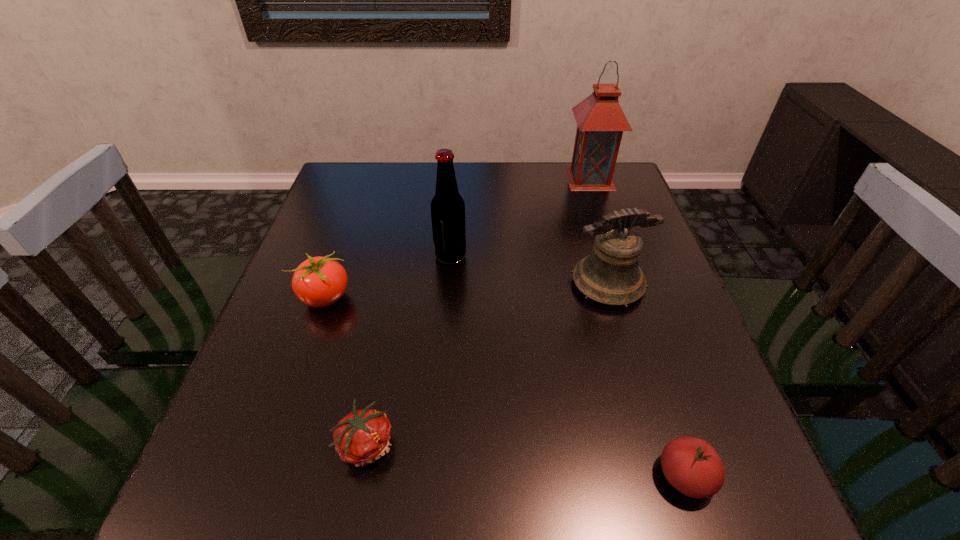
This screenshot has height=540, width=960. In order to click on blank space located on the right of the second tallest object in this screenshot , I will do `click(628, 255)`.

Image resolution: width=960 pixels, height=540 pixels. Identify the location of vacant region located 0.270m on the front of the third tallest object. (651, 433).

At what (x,y) coordinates should I click in order to perform the action: click on free location located 0.110m on the back of the leftmost tomato. Please return your answer as a coordinate pair (x, y). Looking at the image, I should click on (x=342, y=249).

Locate an element on the screen. vacant region located 0.050m on the right of the rightmost tomato is located at coordinates (745, 476).

This screenshot has height=540, width=960. I want to click on vacant point located 0.210m on the right of the second tomato from left to right, so click(522, 443).

Where is `object present at the far edge`? Image resolution: width=960 pixels, height=540 pixels. object present at the far edge is located at coordinates (600, 119).

Identify the location of object located at the left edge. (319, 281).

Find the location of a particular element. Image resolution: width=960 pixels, height=540 pixels. lantern located at the right edge is located at coordinates (600, 119).

The width and height of the screenshot is (960, 540). What are the coordinates of `bell that is positioned at the right edge` in the screenshot? It's located at (610, 275).

Where is `tomato present at the right edge`? tomato present at the right edge is located at coordinates (691, 465).